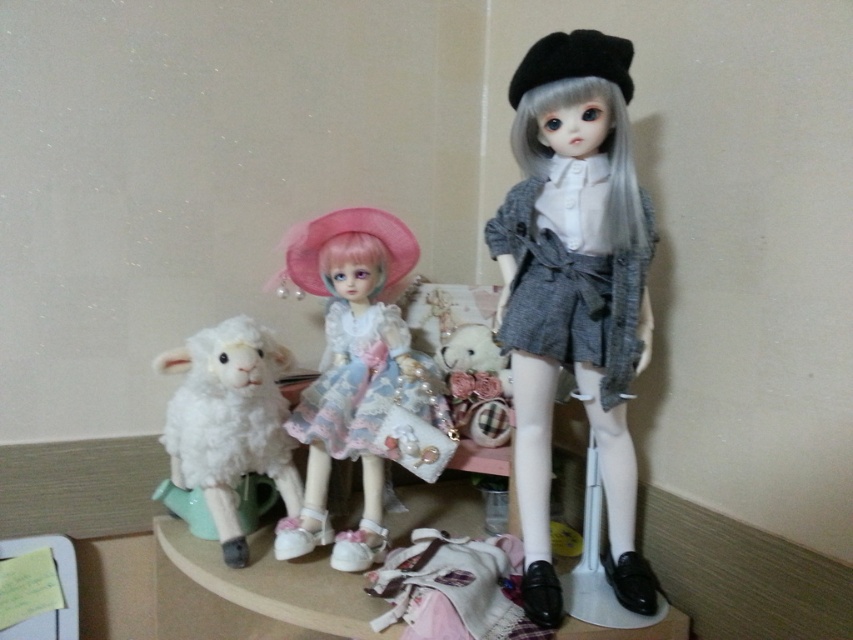
You are organizing a display and need to ensure that the matte pink fabric doll at center and the fluffy white sheep at center are visible from the front. Based on their current positions, which object might block the view of the other?

The matte pink fabric doll at center is in front of the fluffy white sheep at center, so the doll might block the view of the sheep.